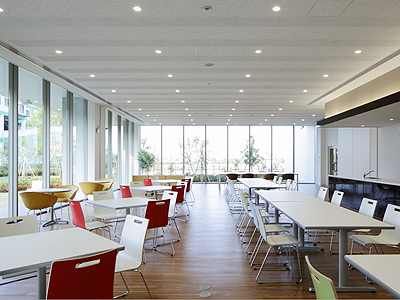
I want to click on tall rectangular window panes in the back of the room, so click(x=151, y=134), click(x=170, y=138), click(x=195, y=136), click(x=218, y=137), click(x=237, y=139), click(x=260, y=141), click(x=287, y=142), click(x=307, y=143).